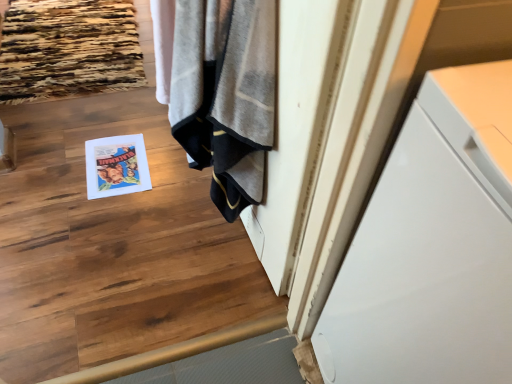
What do you see at coordinates (433, 246) in the screenshot? I see `white glossy cabinet at right` at bounding box center [433, 246].

In order to click on gray textured towel at center in this screenshot , I will do `click(225, 94)`.

From a real-world perspective, is white glossy cabinet at right located beneath matte paper magazine at center?

Actually, white glossy cabinet at right is physically above matte paper magazine at center in the real world.

Are white glossy cabinet at right and matte paper magazine at center making contact?

No, white glossy cabinet at right is not making contact with matte paper magazine at center.

Does white glossy cabinet at right have a greater width compared to matte paper magazine at center?

Correct, the width of white glossy cabinet at right exceeds that of matte paper magazine at center.

Can you confirm if white glossy cabinet at right is thinner than gray textured towel at center?

No, white glossy cabinet at right is not thinner than gray textured towel at center.

Is white glossy cabinet at right not inside gray textured towel at center?

white glossy cabinet at right lies outside gray textured towel at center's area.

Between white glossy cabinet at right and gray textured towel at center, which one has smaller size?

gray textured towel at center.

From the image's perspective, is matte paper magazine at center beneath white glossy cabinet at right?

Actually, matte paper magazine at center appears above white glossy cabinet at right in the image.

Is matte paper magazine at center bigger than white glossy cabinet at right?

Incorrect, matte paper magazine at center is not larger than white glossy cabinet at right.

Is matte paper magazine at center not inside white glossy cabinet at right?

Yes, matte paper magazine at center is outside of white glossy cabinet at right.

Would you say matte paper magazine at center is a long distance from white glossy cabinet at right?

That's right, there is a large distance between matte paper magazine at center and white glossy cabinet at right.

Is matte paper magazine at center smaller than gray textured towel at center?

Yes, matte paper magazine at center is smaller than gray textured towel at center.

Is matte paper magazine at center oriented away from gray textured towel at center?

No.

Considering the positions of objects matte paper magazine at center and gray textured towel at center in the image provided, who is more to the right, matte paper magazine at center or gray textured towel at center?

gray textured towel at center.

Does point (127, 186) appear closer or farther from the camera than point (181, 133)?

Clearly, point (127, 186) is more distant from the camera than point (181, 133).

Image resolution: width=512 pixels, height=384 pixels. Identify the location of magazine below the gray textured towel at center (from a real-world perspective). 116,166.

Can matte paper magazine at center be found inside gray textured towel at center?

No, matte paper magazine at center is located outside of gray textured towel at center.

Is gray textured towel at center positioned with its back to matte paper magazine at center?

That's not correct — gray textured towel at center is not looking away from matte paper magazine at center.

Is gray textured towel at center inside the boundaries of white glossy cabinet at right, or outside?

The correct answer is: outside.

Is gray textured towel at center facing towards white glossy cabinet at right?

No, gray textured towel at center is not aimed at white glossy cabinet at right.

Would you consider gray textured towel at center to be distant from white glossy cabinet at right?

That's not correct — gray textured towel at center is a little close to white glossy cabinet at right.

Can you confirm if gray textured towel at center is thinner than white glossy cabinet at right?

Indeed, gray textured towel at center has a lesser width compared to white glossy cabinet at right.

Identify the location of cabinetry on the right of the matte paper magazine at center. Image resolution: width=512 pixels, height=384 pixels. (433, 246).

At what (x,y) coordinates should I click in order to perform the action: click on bath towel above the white glossy cabinet at right (from the image's perspective). Please return your answer as a coordinate pair (x, y). Looking at the image, I should click on (225, 94).

Which object lies further to the anchor point white glossy cabinet at right, gray textured towel at center or matte paper magazine at center?

Among the two, matte paper magazine at center is located further to white glossy cabinet at right.

Estimate the real-world distances between objects in this image. Which object is further from white glossy cabinet at right, matte paper magazine at center or gray textured towel at center?

matte paper magazine at center.

Estimate the real-world distances between objects in this image. Which object is further from gray textured towel at center, matte paper magazine at center or white glossy cabinet at right?

The object further to gray textured towel at center is matte paper magazine at center.

When comparing their distances from matte paper magazine at center, does gray textured towel at center or white glossy cabinet at right seem closer?

gray textured towel at center lies closer to matte paper magazine at center than the other object.

Which object lies further to the anchor point gray textured towel at center, white glossy cabinet at right or matte paper magazine at center?

Based on the image, matte paper magazine at center appears to be further to gray textured towel at center.

Based on their spatial positions, is white glossy cabinet at right or gray textured towel at center closer to matte paper magazine at center?

gray textured towel at center is closer to matte paper magazine at center.

Image resolution: width=512 pixels, height=384 pixels. What are the coordinates of `bath towel positioned between white glossy cabinet at right and matte paper magazine at center from near to far` in the screenshot? It's located at (225, 94).